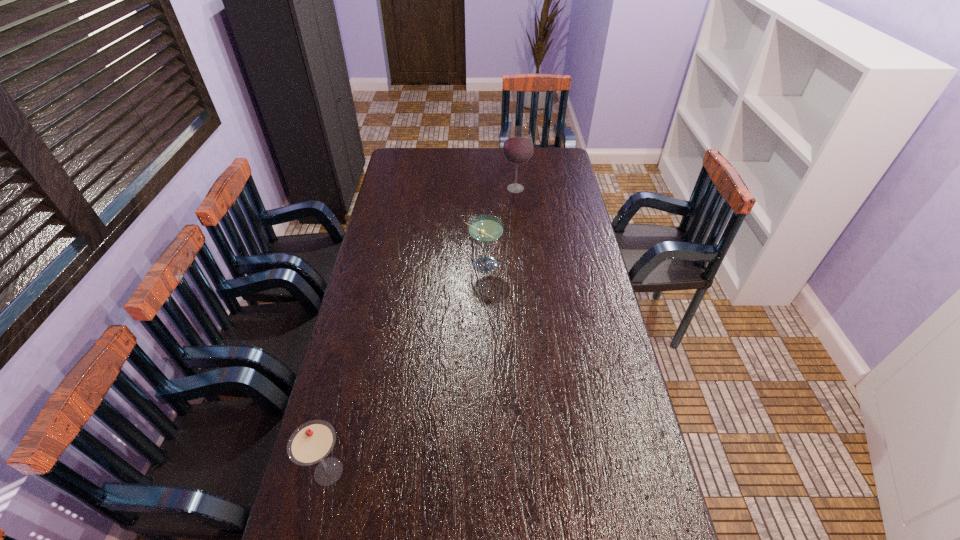
At what (x,y) coordinates should I click in order to perform the action: click on vacant space that's between the tallest object and the nearer martini. Please return your answer as a coordinate pair (x, y). Image resolution: width=960 pixels, height=540 pixels. Looking at the image, I should click on (422, 330).

The image size is (960, 540). Find the location of `object that is the closest to the nearest object`. object that is the closest to the nearest object is located at coordinates (485, 229).

The image size is (960, 540). What are the coordinates of `object that is the closest to the farther martini` in the screenshot? It's located at (518, 147).

This screenshot has height=540, width=960. Identify the location of blank area in the image that satisfies the following two spatial constraints: 1. on the back side of the tallest object; 2. on the left side of the leftmost object. (396, 188).

Find the location of a particular element. free space that satisfies the following two spatial constraints: 1. on the back side of the tallest object; 2. on the left side of the nearest object is located at coordinates (396, 188).